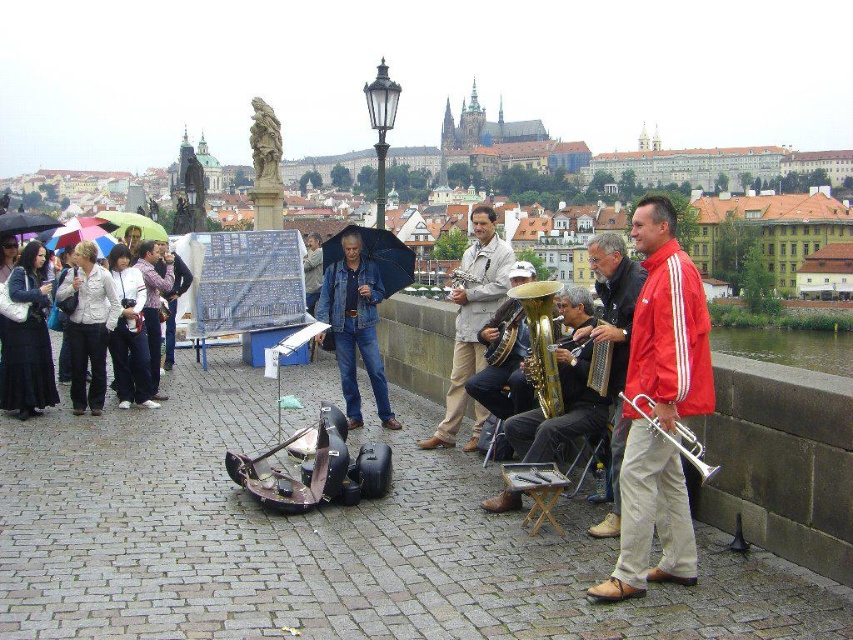
Does gold brass tuba at center lie in front of gold brass trumpet at center?

Yes, it is.

Looking at this image, is gold brass tuba at center below gold brass trumpet at center?

Yes.

Does point (544, 460) lie in front of point (535, 300)?

Yes, point (544, 460) is in front of point (535, 300).

Find the location of a particular element. gold brass tuba at center is located at coordinates (556, 404).

Is the position of gold brass tuba at center more distant than that of silver metallic trumpet at center-right?

Yes, it is behind silver metallic trumpet at center-right.

Is gold brass tuba at center taller than silver metallic trumpet at center-right?

Indeed, gold brass tuba at center has a greater height compared to silver metallic trumpet at center-right.

Is point (563, 364) farther from camera compared to point (709, 468)?

That is True.

This screenshot has height=640, width=853. What are the coordinates of `gold brass tuba at center` in the screenshot? It's located at (556, 404).

Between point (341, 352) and point (590, 362), which one is positioned behind?

The point (341, 352) is behind.

Which is more to the right, blue jeans at center or metallic accordion at center?

Positioned to the right is metallic accordion at center.

What do you see at coordinates (354, 324) in the screenshot?
I see `blue jeans at center` at bounding box center [354, 324].

The image size is (853, 640). What are the coordinates of `blue jeans at center` in the screenshot? It's located at (354, 324).